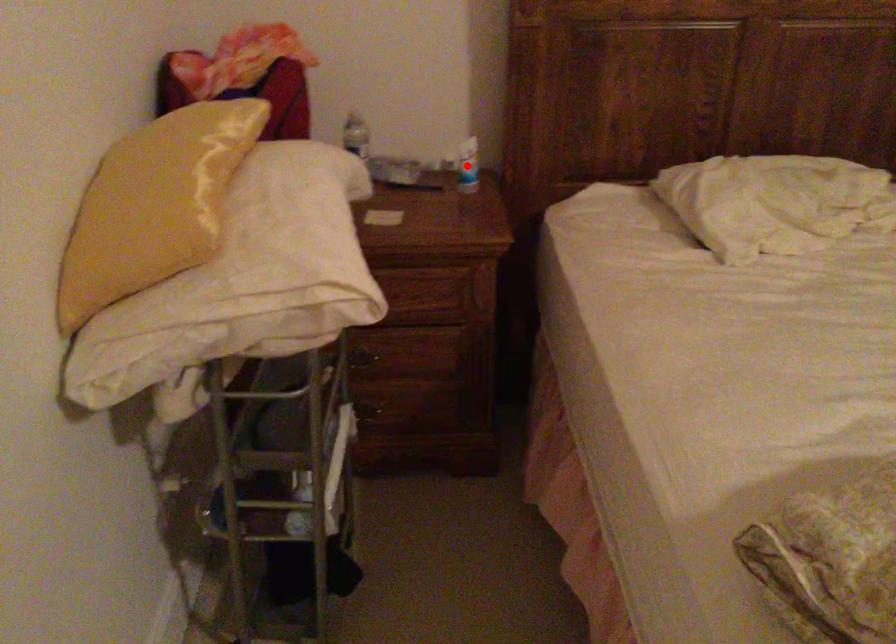
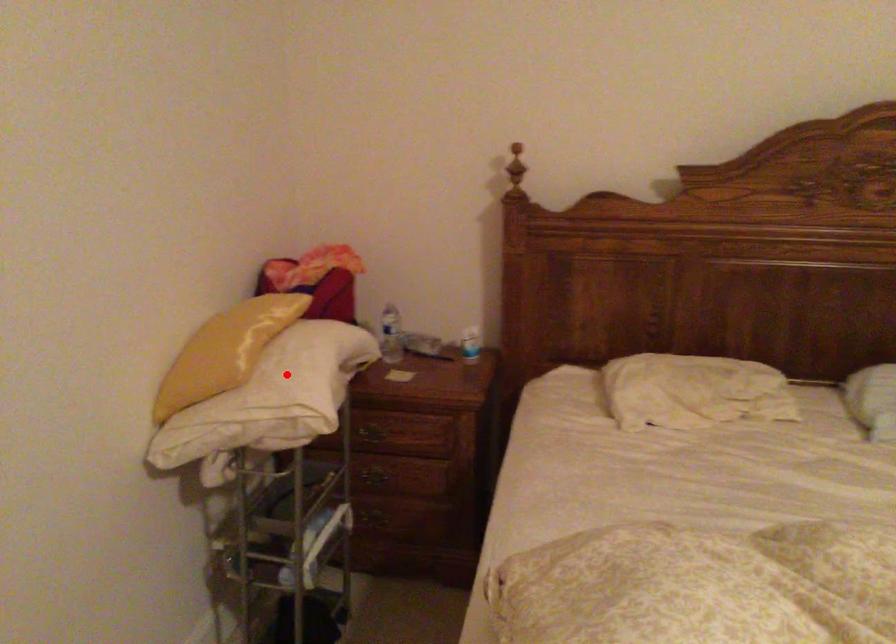
I am providing you with two images of the same scene from different viewpoints. A red point is marked on the first image and another point is marked on the second image. Does the point marked in image1 correspond to the same location as the one in image2?

No